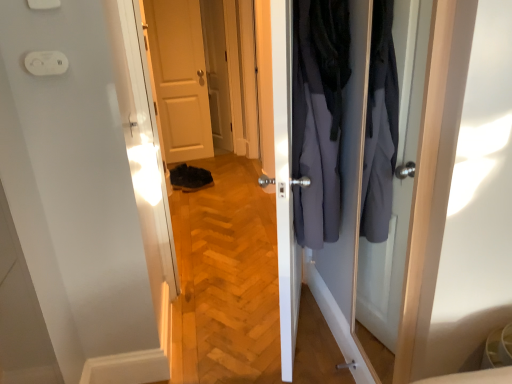
Locate an element on the screen. This screenshot has height=384, width=512. vacant region under matte white door at center (from a real-world perspective) is located at coordinates (187, 157).